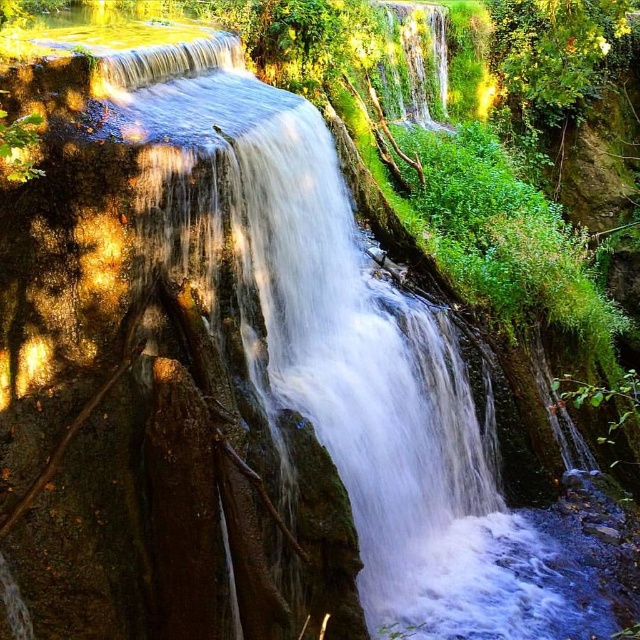
You are standing at the edge of the pool and want to locate the white frothy water at center. According to the coordinates provided, where exactly would you find it?

The white frothy water at center is located at coordinates point (x=336, y=333).

You are standing at the edge of the pool and want to take a photo of the white frothy water at center and the green leafy tree at upper right. Which object should you focus on first if you want to capture both in a single frame without moving the camera?

You should focus on the white frothy water at center first because it has a greater height compared to the green leafy tree at upper right, allowing it to be positioned prominently in the frame while still including the tree in the background.